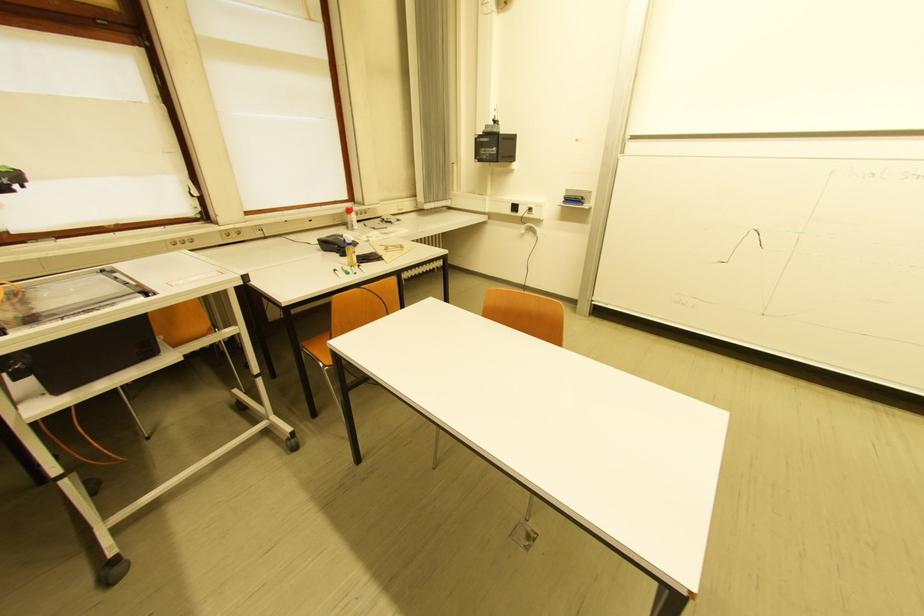
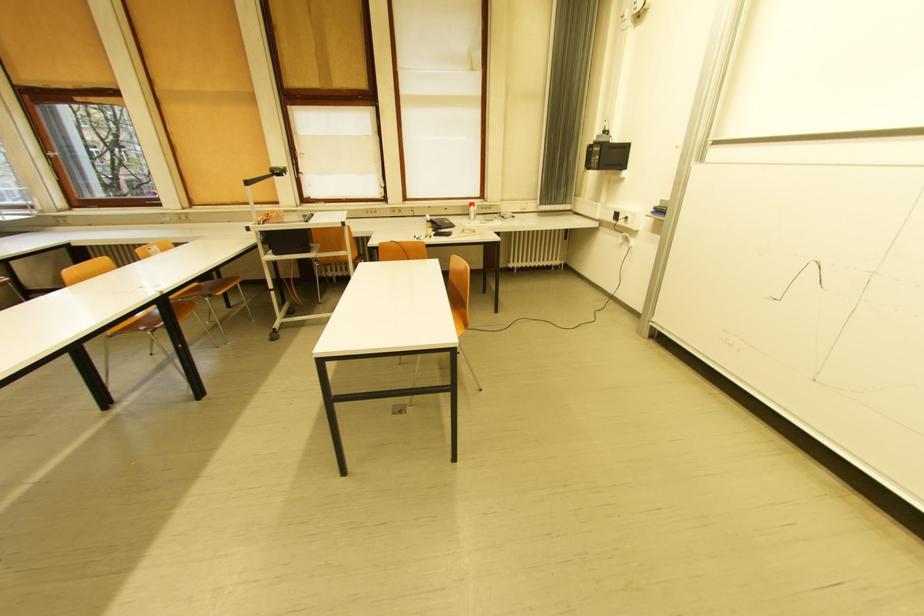
Where in the second image is the point corresponding to (x=572, y=199) from the first image?

(662, 209)